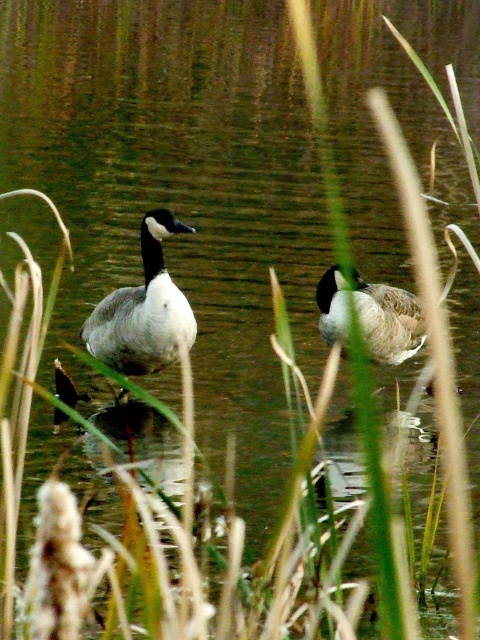
Question: Where is white matte duck at center located in relation to gray matte duck at center in the image?

Choices:
 (A) right
 (B) left

Answer: (B)

Question: Which object appears farthest from the camera in this image?

Choices:
 (A) white matte duck at center
 (B) gray matte duck at center

Answer: (B)

Question: Is white matte duck at center smaller than gray matte duck at center?

Choices:
 (A) no
 (B) yes

Answer: (A)

Question: Is white matte duck at center bigger than gray matte duck at center?

Choices:
 (A) no
 (B) yes

Answer: (B)